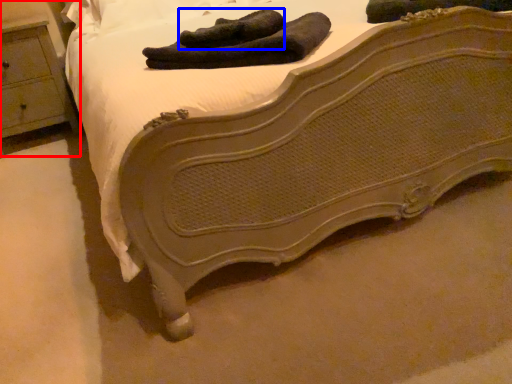
Question: Which object appears farthest to the camera in this image, nightstand (highlighted by a red box) or footwear (highlighted by a blue box)?

Choices:
 (A) nightstand
 (B) footwear

Answer: (A)